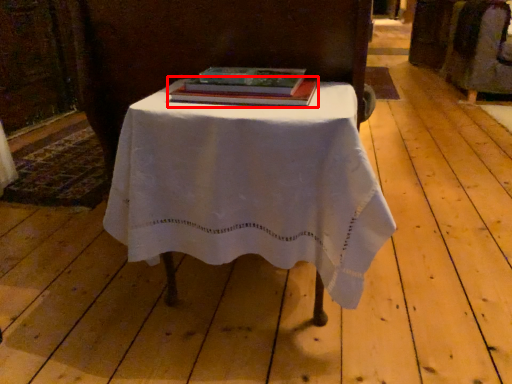
Question: Where is book (annotated by the red box) located in relation to table in the image?

Choices:
 (A) right
 (B) left

Answer: (B)